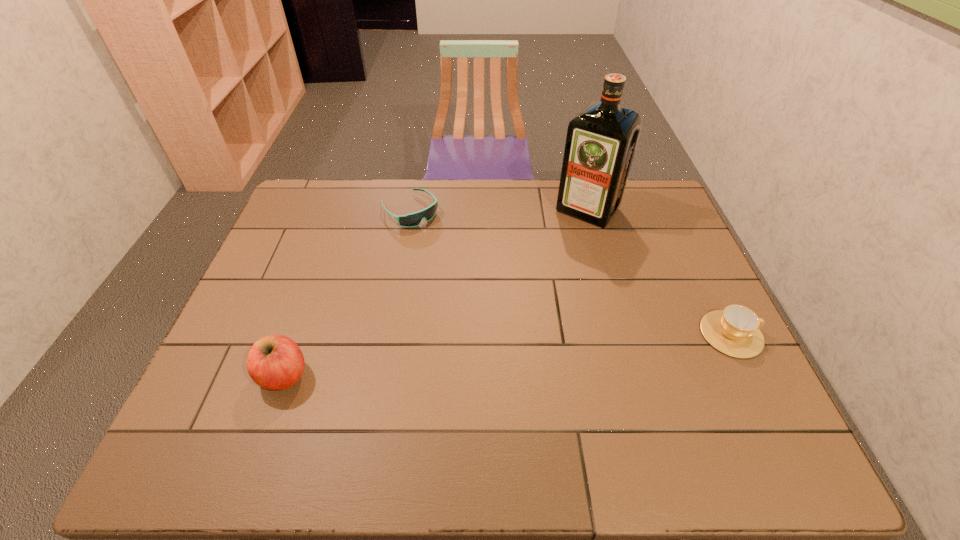
Find the location of a particular element. This screenshot has width=960, height=540. free space on the desktop that is between the second tallest object and the cup and is positioned on the front label of the tallest object is located at coordinates (469, 358).

This screenshot has height=540, width=960. What are the coordinates of `vacant space on the desktop that is between the leftmost object and the rightmost object and is positioned on the front-facing side of the sunglasses` in the screenshot? It's located at (549, 351).